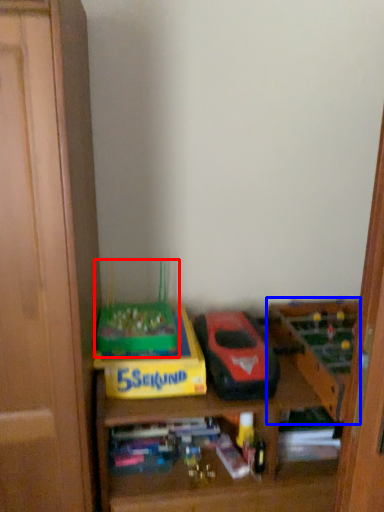
Question: Which point is closer to the camera, toy (highlighted by a red box) or toy (highlighted by a blue box)?

Choices:
 (A) toy
 (B) toy

Answer: (B)